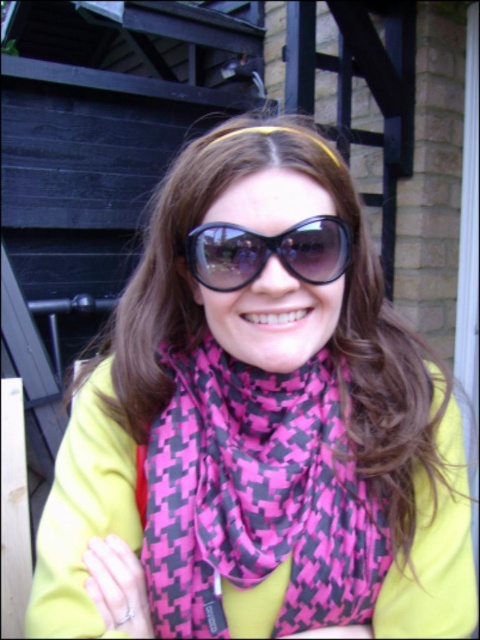
Question: Is pink/black houndstooth scarf at center positioned behind black glossy sunglasses at center?

Choices:
 (A) no
 (B) yes

Answer: (B)

Question: Which point appears farthest from the camera in this image?

Choices:
 (A) (240, 262)
 (B) (235, 384)

Answer: (B)

Question: Can you confirm if pink/black houndstooth scarf at center is positioned to the left of black glossy sunglasses at center?

Choices:
 (A) no
 (B) yes

Answer: (B)

Question: Which object is farther from the camera taking this photo?

Choices:
 (A) black glossy sunglasses at center
 (B) pink/black houndstooth scarf at center

Answer: (B)

Question: Does pink/black houndstooth scarf at center have a larger size compared to black glossy sunglasses at center?

Choices:
 (A) no
 (B) yes

Answer: (B)